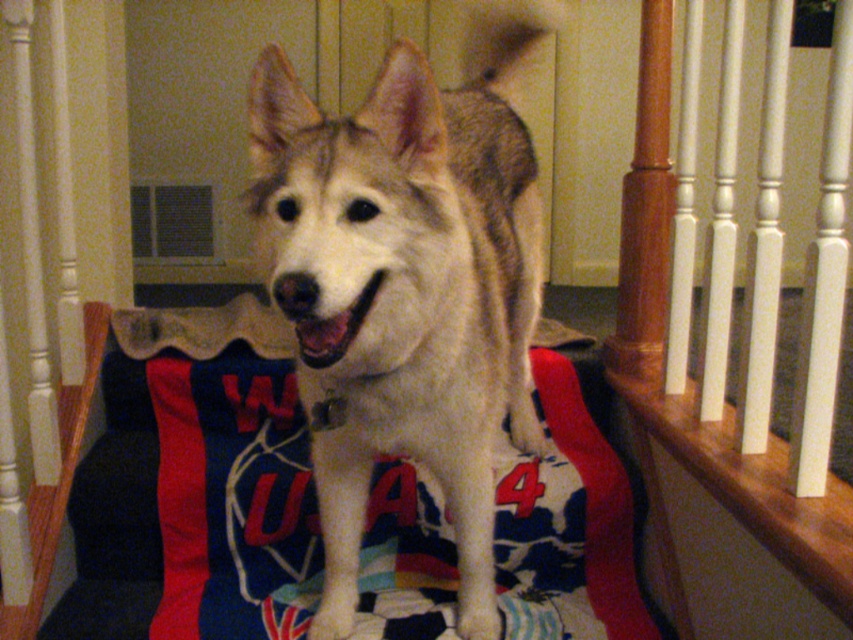
You are an interior designer assessing the space shown. The red and blue striped fabric at center is part of a dog jersey. You need to hang a decorative hook on the white wood railing at upper center. Considering the spatial relationship between the two objects, which object is lower and thus more suitable for placing the hook at a comfortable height for hanging items?

The red and blue striped fabric at center is shorter than the white wood railing at upper center, so the red and blue striped fabric at center is lower and more suitable for placing the hook at a comfortable height.

You are an interior designer assessing the layout of a home. You see the red and blue striped fabric at center and the white wood railing at upper center. Which object is closer to you?

The red and blue striped fabric at center is closer to you because the white wood railing at upper center is behind it.

Looking at this image, based on the scene description, can you determine which object is taller between the white fur dog at center and the white wood railing at upper center?

The white fur dog at center is taller than the white wood railing at upper center according to the description.